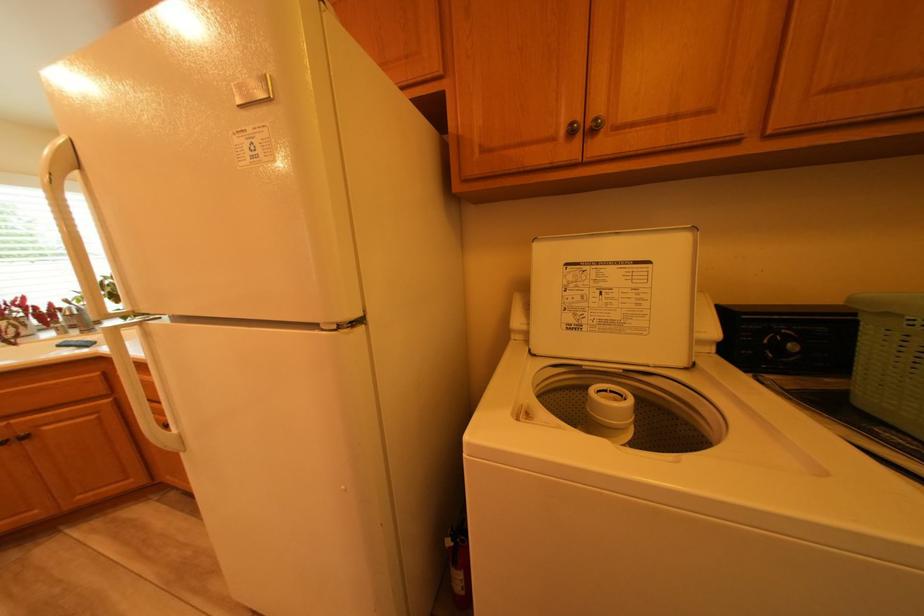
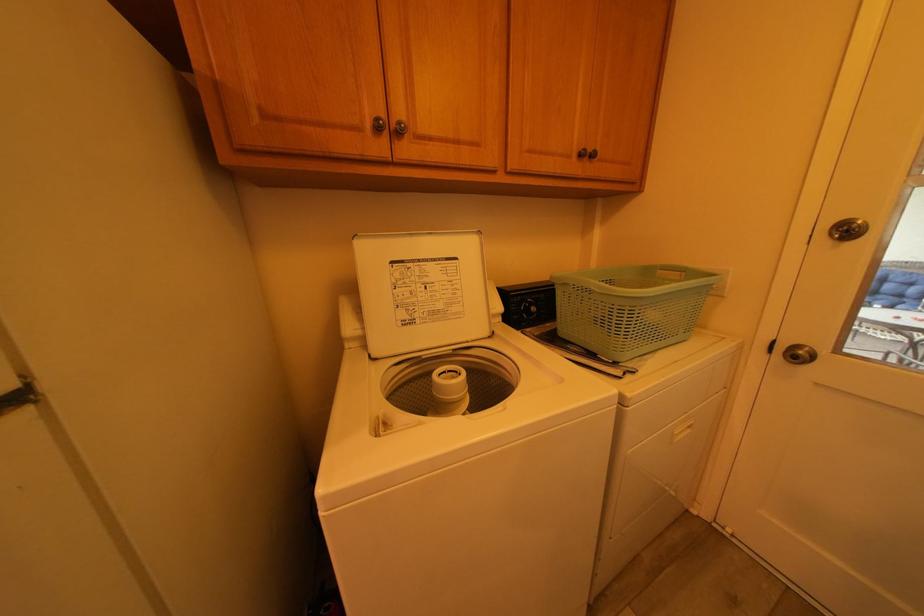
The point at (567, 140) is marked in the first image. Where is the corresponding point in the second image?

(373, 130)